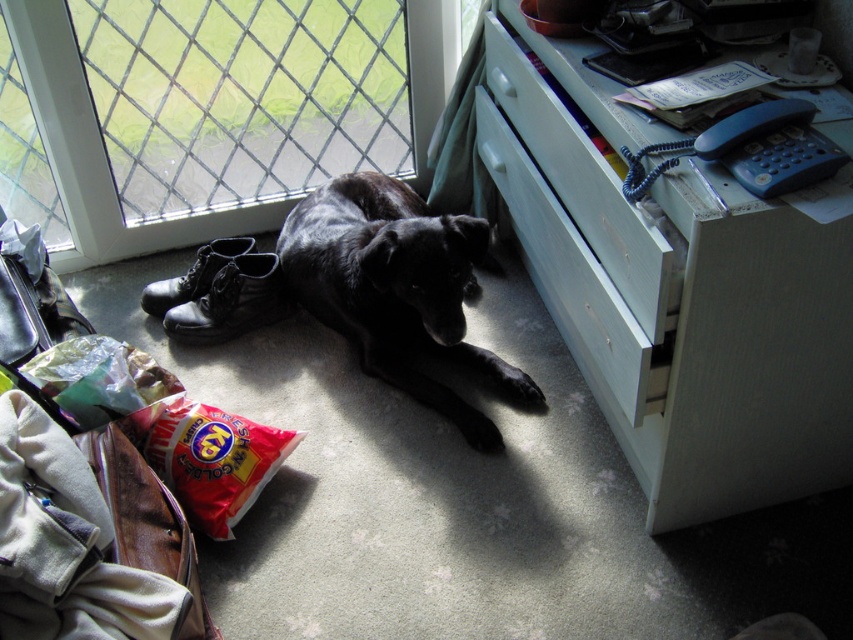
Question: Which point is closer to the camera taking this photo?

Choices:
 (A) (164, 280)
 (B) (415, 35)
 (C) (199, 310)
 (D) (33, 483)

Answer: (D)

Question: Can you confirm if velvet fabric bag at lower left is thinner than clear glass window at upper left?

Choices:
 (A) no
 (B) yes

Answer: (B)

Question: Among these objects, which one is farthest from the camera?

Choices:
 (A) white wood file cabinet at right
 (B) matte black boot at lower left

Answer: (B)

Question: Can you confirm if velvet fabric bag at lower left is wider than light blue wood drawer at center right?

Choices:
 (A) no
 (B) yes

Answer: (B)

Question: Which object appears closest to the camera in this image?

Choices:
 (A) matte black boot at lower left
 (B) light blue wood drawer at center right

Answer: (B)

Question: Does clear glass window at upper left have a lesser width compared to light blue wood drawer at center right?

Choices:
 (A) no
 (B) yes

Answer: (A)